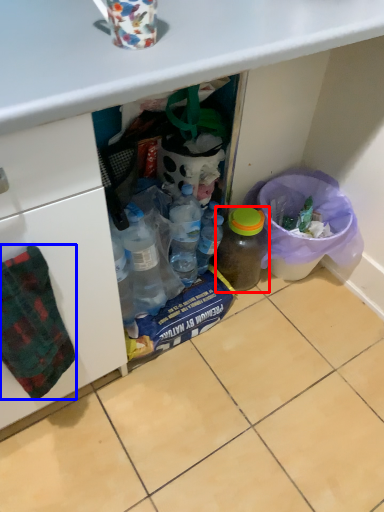
Question: Which of the following is the farthest to the observer, bottle (highlighted by a red box) or blanket (highlighted by a blue box)?

Choices:
 (A) bottle
 (B) blanket

Answer: (A)